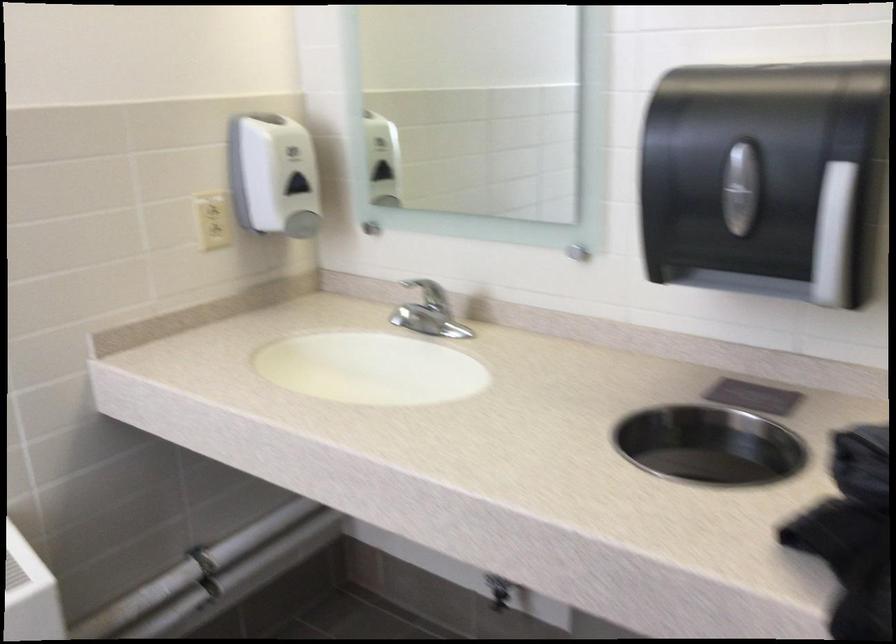
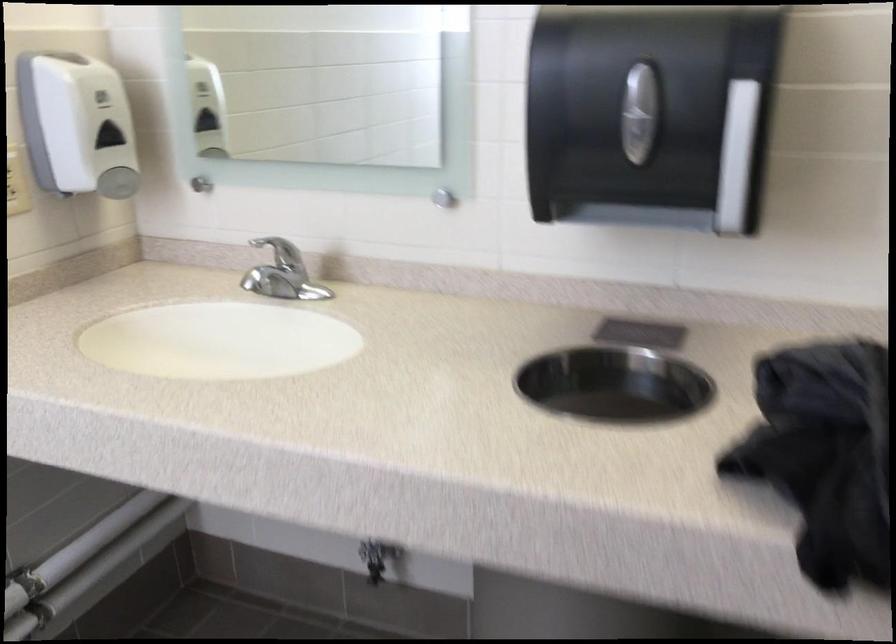
The images are taken continuously from a first-person perspective. In which direction are you moving?

The cameraman moved toward left, forward.